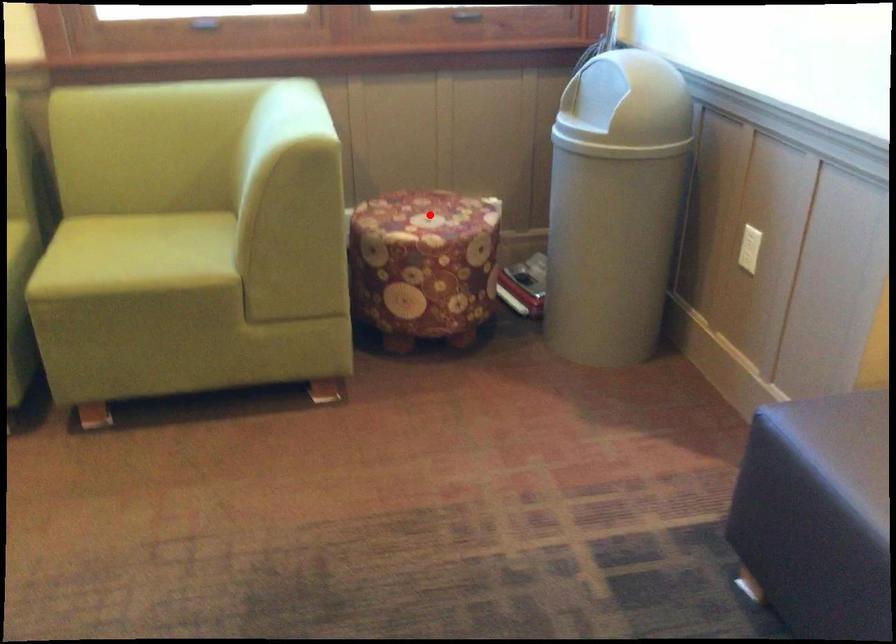
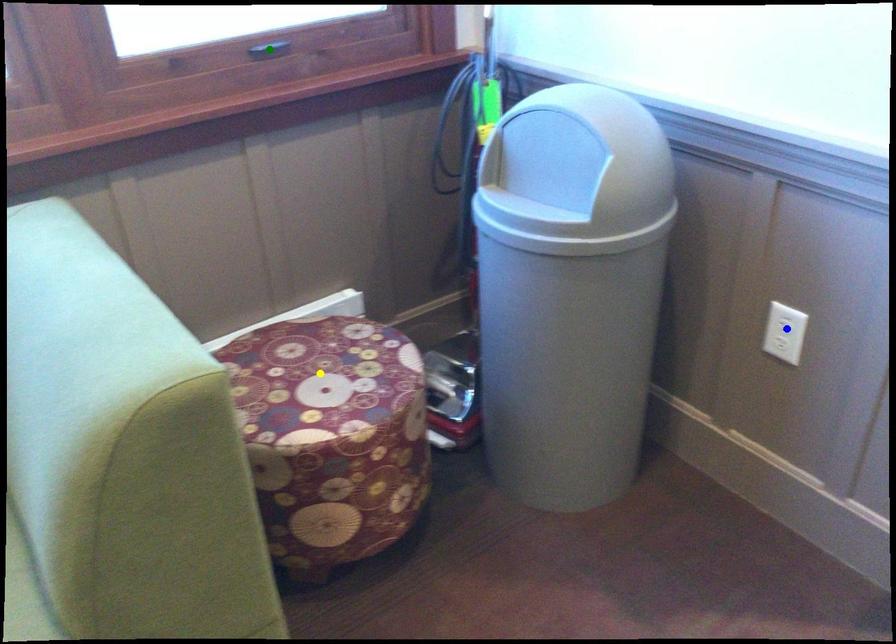
Question: I am providing you with two images of the same scene from different viewpoints. A red point is marked on the first image. You are given multiple points on the second image. Can you choose the point in image 2 that corresponds to the point in image 1?

Choices:
 (A) yellow point
 (B) green point
 (C) blue point

Answer: (A)